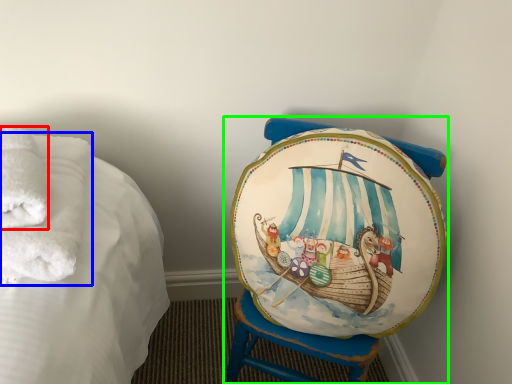
Question: Which is farther away from bath towel (highlighted by a red box)? bath towel (highlighted by a blue box) or furniture (highlighted by a green box)?

Choices:
 (A) bath towel
 (B) furniture

Answer: (B)